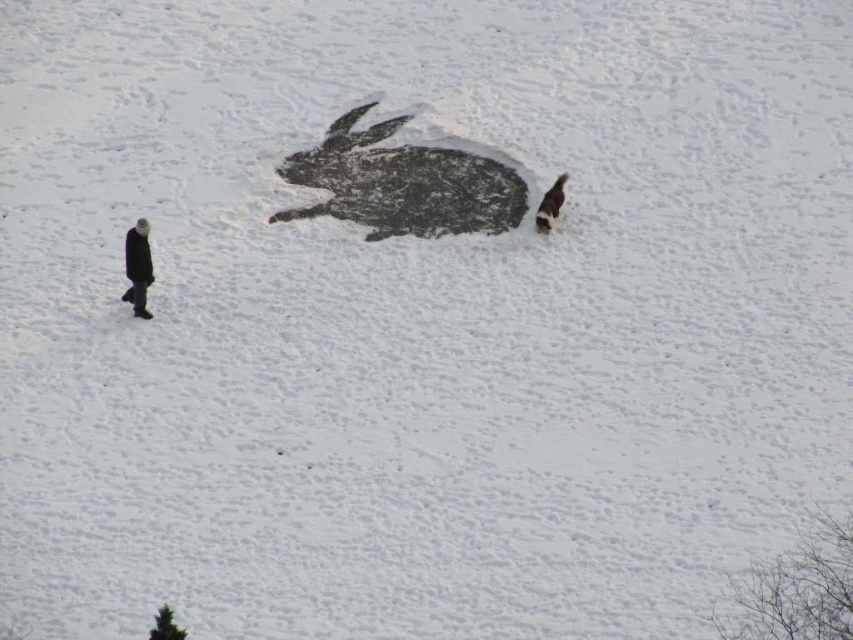
Can you confirm if dark gray wool coat at left is bigger than fluffy white dog at right?

Indeed, dark gray wool coat at left has a larger size compared to fluffy white dog at right.

Is dark gray wool coat at left shorter than fluffy white dog at right?

No, dark gray wool coat at left is not shorter than fluffy white dog at right.

The width and height of the screenshot is (853, 640). What do you see at coordinates (137, 268) in the screenshot?
I see `dark gray wool coat at left` at bounding box center [137, 268].

The height and width of the screenshot is (640, 853). Identify the location of dark gray wool coat at left. (137, 268).

Is black textured snow rabbit at center to the left of fluffy white dog at right from the viewer's perspective?

Correct, you'll find black textured snow rabbit at center to the left of fluffy white dog at right.

In the scene shown: Who is more distant from viewer, (480,193) or (560,179)?

The point (480,193) is more distant.

The width and height of the screenshot is (853, 640). Find the location of `black textured snow rabbit at center`. black textured snow rabbit at center is located at coordinates (403, 182).

Who is more distant from viewer, (x=381, y=125) or (x=149, y=260)?

Positioned behind is point (x=381, y=125).

Image resolution: width=853 pixels, height=640 pixels. In order to click on black textured snow rabbit at center in this screenshot , I will do `click(403, 182)`.

Which is behind, point (310, 148) or point (134, 268)?

Point (310, 148)

At what (x,y) coordinates should I click in order to perform the action: click on black textured snow rabbit at center. Please return your answer as a coordinate pair (x, y). The width and height of the screenshot is (853, 640). Looking at the image, I should click on (403, 182).